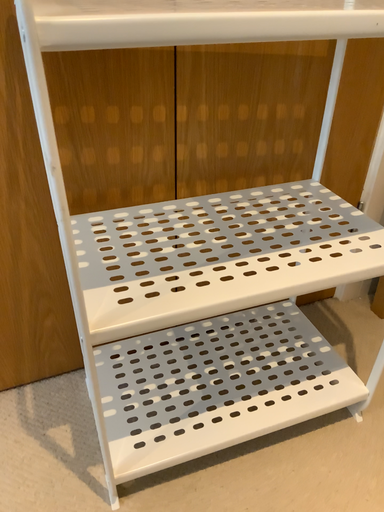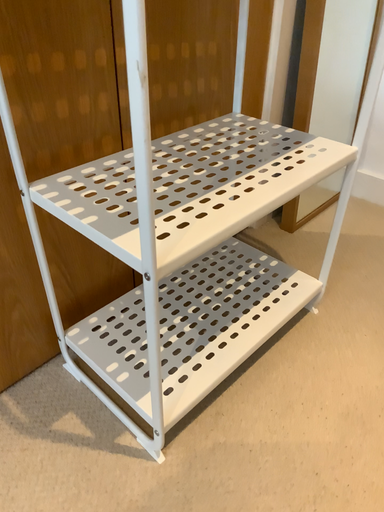
Question: How did the camera likely rotate when shooting the video?

Choices:
 (A) rotated left
 (B) rotated right

Answer: (B)